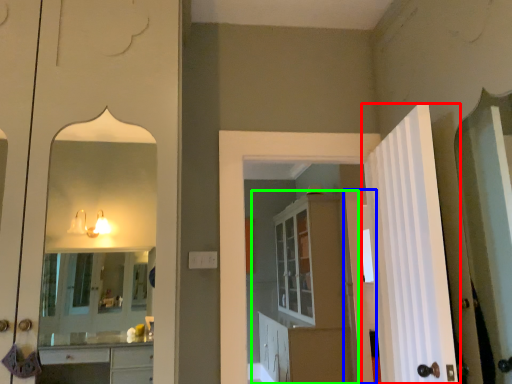
Question: Which is nearer to the door (highlighted by a red box)? door (highlighted by a blue box) or dresser (highlighted by a green box).

Choices:
 (A) door
 (B) dresser

Answer: (A)